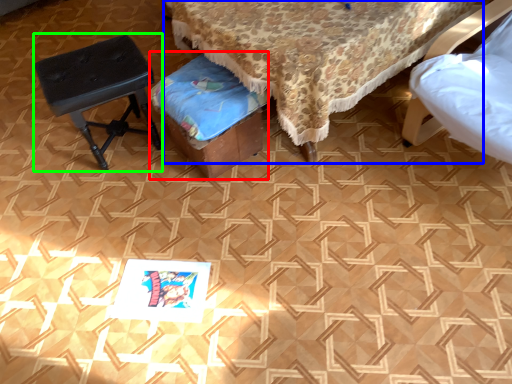
Question: Which object is the closest to the music stool (highlighted by a red box)? Choose among these: furniture (highlighted by a blue box) or stool (highlighted by a green box).

Choices:
 (A) furniture
 (B) stool

Answer: (A)